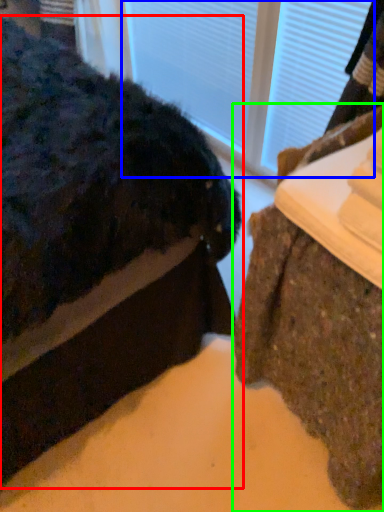
Question: Which object is positioned closest to furniture (highlighted by a red box)? Select from glass door (highlighted by a blue box) and furniture (highlighted by a green box).

Choices:
 (A) glass door
 (B) furniture

Answer: (B)